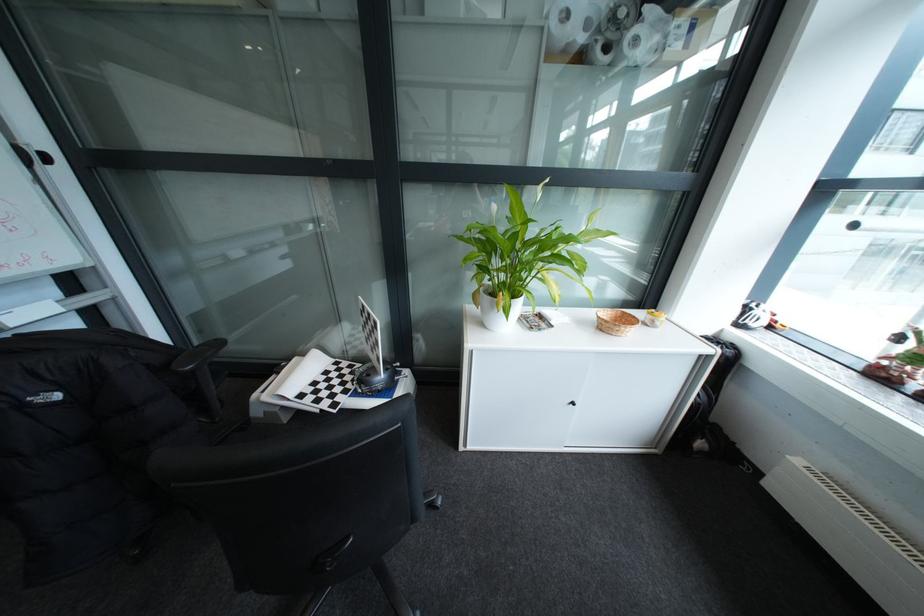
Image resolution: width=924 pixels, height=616 pixels. I want to click on black cabinet knob, so click(572, 403).